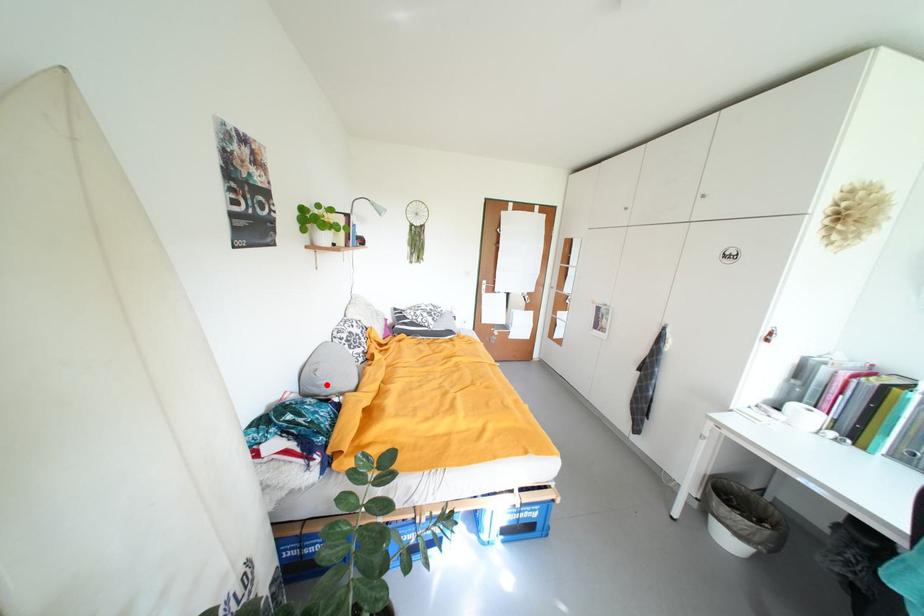
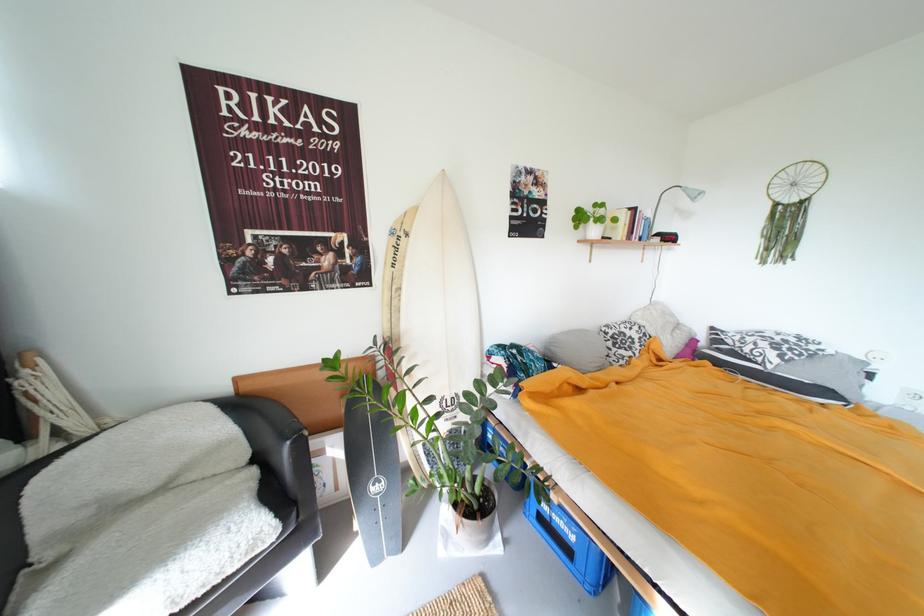
The point at the highlighted location is marked in the first image. Where is the corresponding point in the second image?

(560, 350)